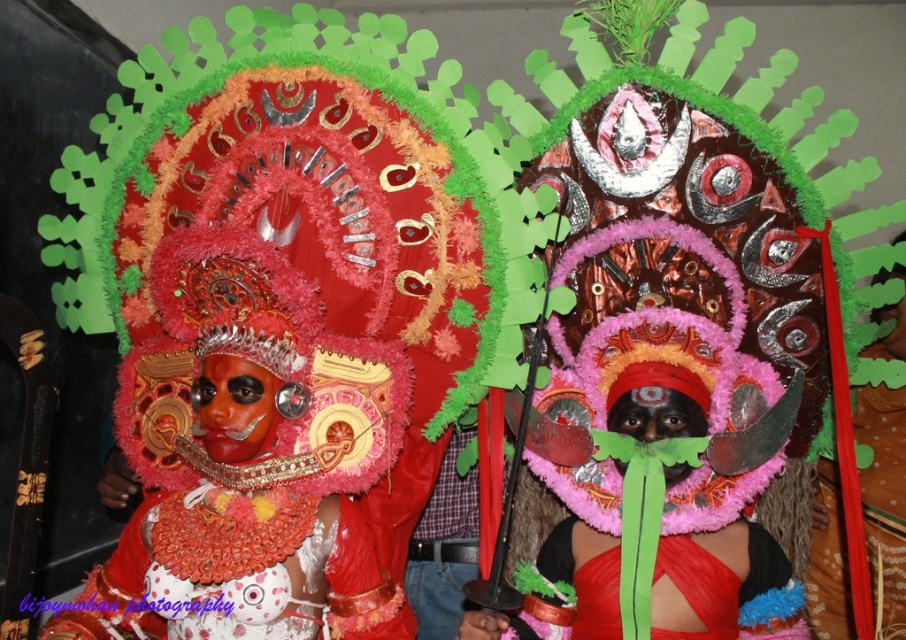
The height and width of the screenshot is (640, 906). Describe the element at coordinates (733, 589) in the screenshot. I see `green feather headdress at center` at that location.

Can you confirm if green feather headdress at center is thinner than shiny red fabric at center?

No, green feather headdress at center is not thinner than shiny red fabric at center.

Where is `green feather headdress at center`? The width and height of the screenshot is (906, 640). green feather headdress at center is located at coordinates (733, 589).

Can you confirm if matte red mask at center is positioned below shiny red fabric at center?

No.

Is matte red mask at center smaller than shiny red fabric at center?

Actually, matte red mask at center might be larger than shiny red fabric at center.

The height and width of the screenshot is (640, 906). In order to click on matte red mask at center in this screenshot , I will do (x=246, y=460).

Where is `matte red mask at center`? matte red mask at center is located at coordinates (246, 460).

Between matte red mask at center and green feather headdress at center, which one is positioned lower?

Positioned lower is green feather headdress at center.

Is matte red mask at center thinner than green feather headdress at center?

No.

Does point (243, 595) come farther from viewer compared to point (721, 630)?

No, (243, 595) is in front of (721, 630).

The height and width of the screenshot is (640, 906). Find the location of `matte red mask at center`. matte red mask at center is located at coordinates (246, 460).